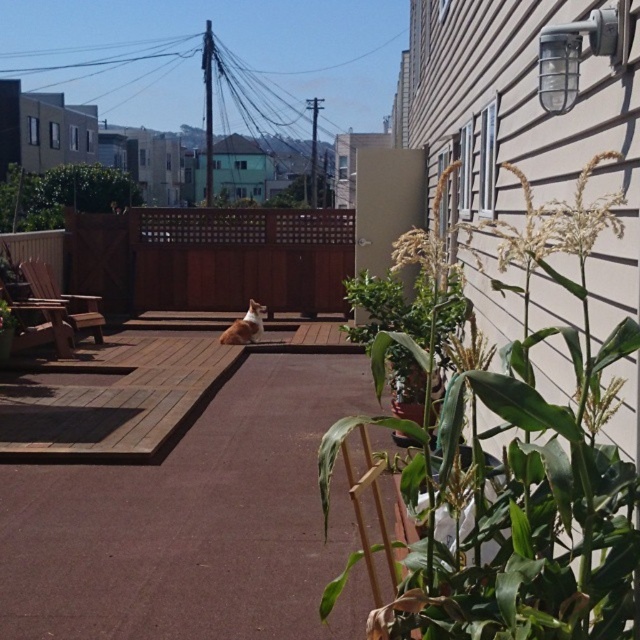
You are a photographer setting up a shot in this backyard. You want to capture both the green leafy plant at right and the white fur cat at center in your frame. Which object should you focus on first if you want to ensure both are in focus? Please explain your reasoning based on their sizes and positions.

The green leafy plant at right is larger than the white fur cat at center. To ensure both are in focus, you should focus on the larger object first, which is the green leafy plant at right, as depth of field is more forgiving with larger subjects and their details are spread over a wider area.

You are a person standing on the brown wooden deck at center. You want to place a tall flower pot on the deck so it won t fall off. Considering the deck s height compared to the green leafy plant at right, where should you place the flower pot?

The brown wooden deck at center is not as tall as the green leafy plant at right. To prevent the flower pot from falling off, place it closer to the center of the deck where it will be more stable, since the deck s lower height compared to the plant means the edges might be less secure.